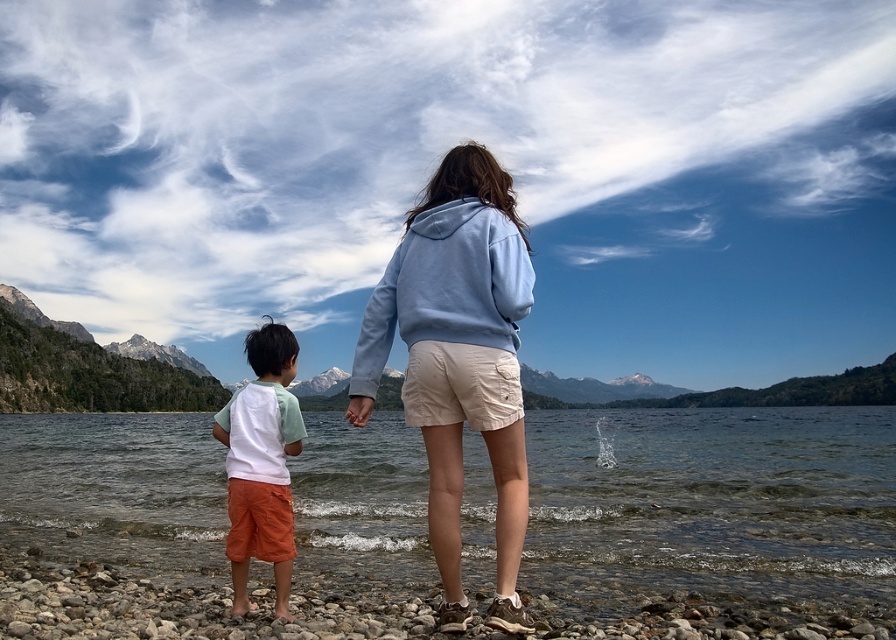
Does light blue fleece sweatshirt at center have a lesser width compared to white cotton shirt at lower left?

Correct, light blue fleece sweatshirt at center's width is less than white cotton shirt at lower left's.

Based on the photo, does light blue fleece sweatshirt at center have a larger size compared to white cotton shirt at lower left?

Actually, light blue fleece sweatshirt at center might be smaller than white cotton shirt at lower left.

The width and height of the screenshot is (896, 640). I want to click on light blue fleece sweatshirt at center, so click(446, 288).

In order to click on light blue fleece sweatshirt at center in this screenshot , I will do `click(446, 288)`.

Who is taller, smooth pebbles at lower center or light blue fleece sweatshirt at center?

Standing taller between the two is light blue fleece sweatshirt at center.

Who is more forward, (162,616) or (442,224)?

Point (162,616)

Find the location of a particular element. smooth pebbles at lower center is located at coordinates coord(191,609).

Does point (470, 538) come behind point (438, 288)?

That is True.

Does point (544, 545) lie in front of point (436, 205)?

That is False.

Find the location of a particular element. This screenshot has height=640, width=896. smooth water at lower center is located at coordinates (711, 502).